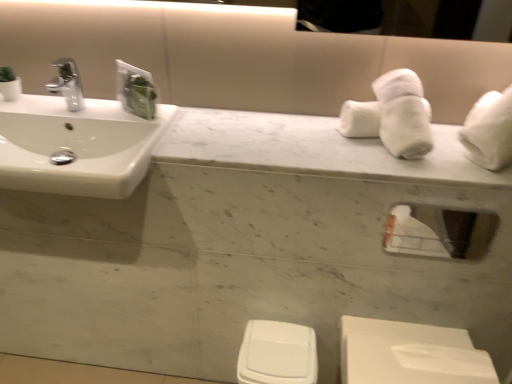
Question: In the image, is white plastic toilet bowl at lower center positioned in front of or behind white glossy sink at left?

Choices:
 (A) front
 (B) behind

Answer: (B)

Question: Considering the positions of point click(250, 349) and point click(93, 129), is point click(250, 349) closer or farther from the camera than point click(93, 129)?

Choices:
 (A) closer
 (B) farther

Answer: (B)

Question: Estimate the real-world distances between objects in this image. Which object is farther from the white glossy sink at left?

Choices:
 (A) clear glass mirror at upper right
 (B) white glossy toilet at lower right
 (C) white plastic toilet bowl at lower center
 (D) white marble counter top at center

Answer: (A)

Question: Which object is positioned farthest from the white glossy sink at left?

Choices:
 (A) white marble counter top at center
 (B) clear glass mirror at upper right
 (C) white plastic toilet bowl at lower center
 (D) white glossy toilet at lower right

Answer: (B)